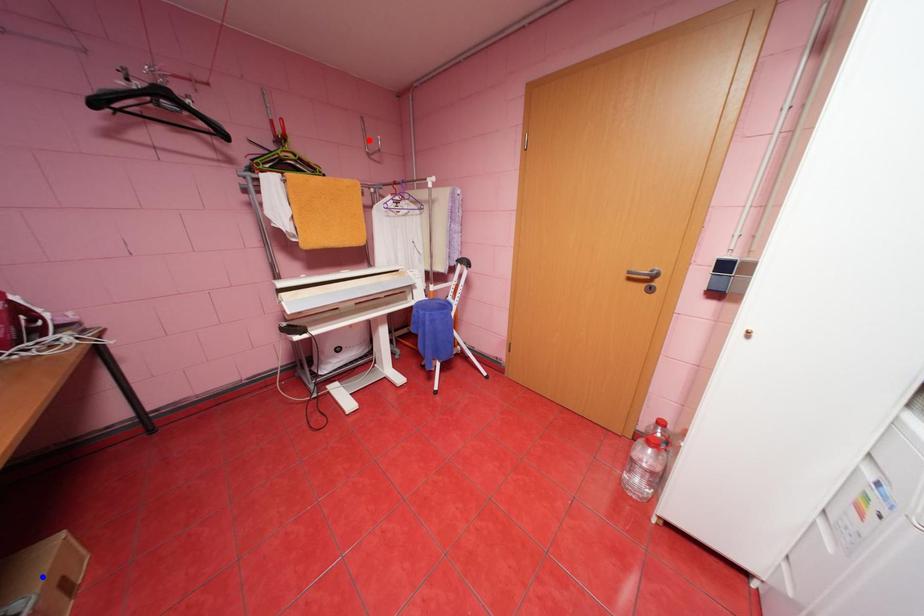
Question: Two points are marked on the image. Which point is closer to the camera?

Choices:
 (A) Blue point is closer.
 (B) Red point is closer.

Answer: (A)